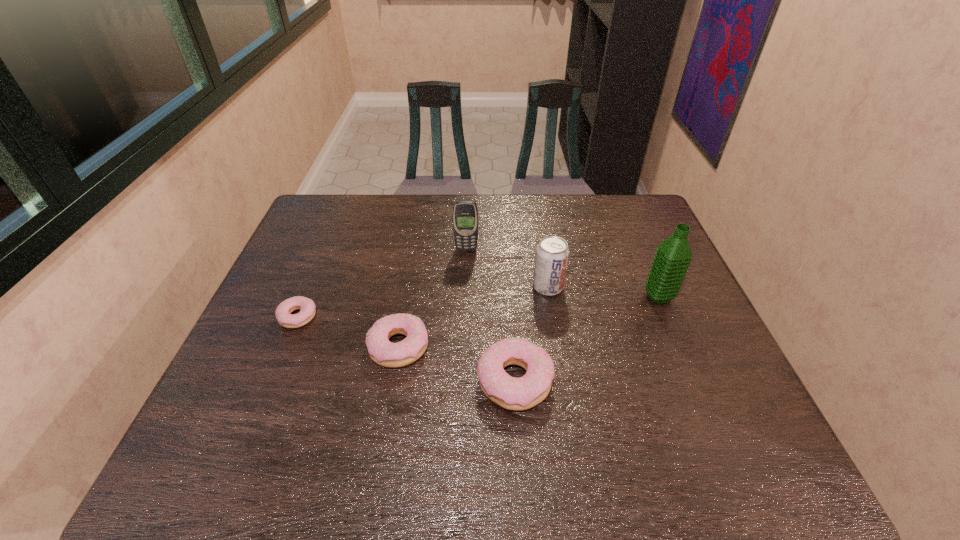
The image size is (960, 540). Find the location of `free spot between the water bottle and the third tallest object`. free spot between the water bottle and the third tallest object is located at coordinates (603, 292).

Identify the location of free space between the fifth tallest object and the cellular telephone. This screenshot has height=540, width=960. (433, 298).

Where is `vacant area that lies between the rightmost doughnut and the second tallest doughnut`? Image resolution: width=960 pixels, height=540 pixels. vacant area that lies between the rightmost doughnut and the second tallest doughnut is located at coordinates (457, 363).

The width and height of the screenshot is (960, 540). I want to click on object that ranks as the closest to the rightmost doughnut, so click(x=383, y=352).

The image size is (960, 540). In order to click on object that stands as the fourth closest to the rightmost doughnut in this screenshot , I will do `click(465, 213)`.

Point out which doughnut is positioned as the second nearest to the leftmost doughnut. Please provide its 2D coordinates. Your answer should be formatted as a tuple, i.e. [(x, y)], where the tuple contains the x and y coordinates of a point satisfying the conditions above.

[(525, 392)]

You are a GUI agent. You are given a task and a screenshot of the screen. Output one action in this format:
    pyautogui.click(x=<x>, y=<y>)
    Task: Click on the third closest doughnut to the soda can
    This screenshot has width=960, height=540.
    Given the screenshot: What is the action you would take?
    pyautogui.click(x=307, y=307)

This screenshot has width=960, height=540. I want to click on vacant region that satisfies the following two spatial constraints: 1. on the screen of the farthest object; 2. on the left side of the rightmost doughnut, so click(x=462, y=380).

This screenshot has width=960, height=540. In order to click on blank space that satisfies the following two spatial constraints: 1. on the screen of the soda can; 2. on the right side of the cellular telephone in this screenshot , I will do `click(465, 287)`.

The image size is (960, 540). What are the coordinates of `free space that satisfies the following two spatial constraints: 1. on the screen of the soda can; 2. on the left side of the cellular telephone` in the screenshot? It's located at (465, 287).